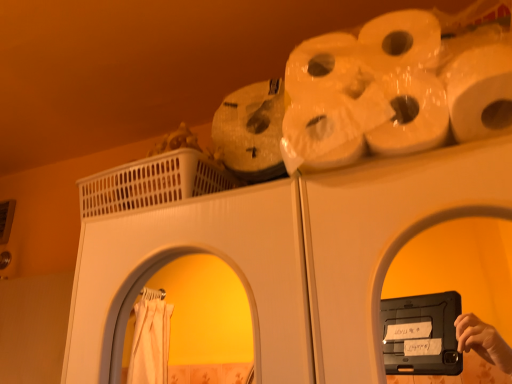
Describe the element at coordinates (393, 88) in the screenshot. I see `white glossy toilet paper at upper right` at that location.

Identify the location of white glossy toilet paper at upper right. This screenshot has width=512, height=384. (393, 88).

The height and width of the screenshot is (384, 512). I want to click on white glossy toilet paper at upper right, so click(393, 88).